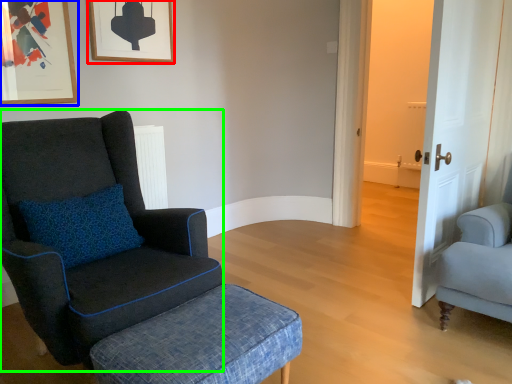
Question: Which is nearer to the picture frame (highlighted by a red box)? picture frame (highlighted by a blue box) or chair (highlighted by a green box).

Choices:
 (A) picture frame
 (B) chair

Answer: (A)